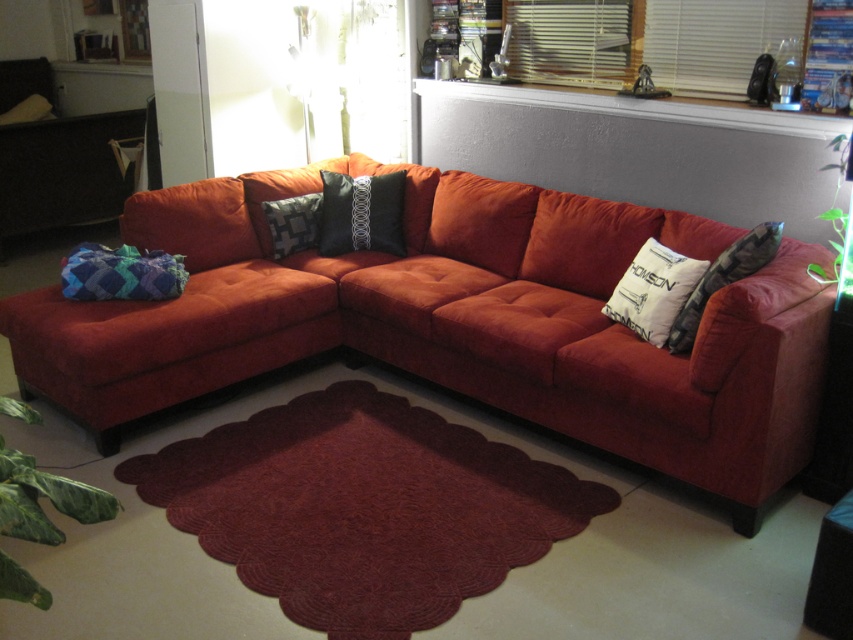
Which is in front, point (361, 216) or point (9, 113)?

Point (361, 216)

The height and width of the screenshot is (640, 853). In order to click on black satin pillow at center in this screenshot , I will do `click(361, 212)`.

Does satin black pillow at center appear under dark gray textured pillow at upper left?

Correct, satin black pillow at center is located below dark gray textured pillow at upper left.

Does satin black pillow at center appear on the right side of dark gray textured pillow at upper left?

Yes, satin black pillow at center is to the right of dark gray textured pillow at upper left.

Which is behind, point (268, 204) or point (44, 112)?

The point (44, 112) is more distant.

Where is `satin black pillow at center`? satin black pillow at center is located at coordinates (293, 221).

Is white cotton pillow at center to the right of white printed pillow at right from the viewer's perspective?

Incorrect, white cotton pillow at center is not on the right side of white printed pillow at right.

Measure the distance between white cotton pillow at center and camera.

white cotton pillow at center and camera are 2.71 meters apart.

Find the location of `white cotton pillow at center`. white cotton pillow at center is located at coordinates (653, 291).